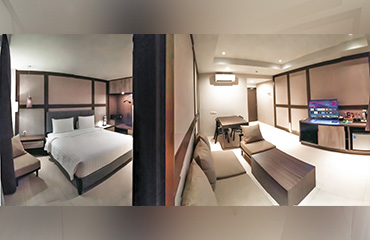
The width and height of the screenshot is (370, 240). I want to click on bed, so click(95, 144).